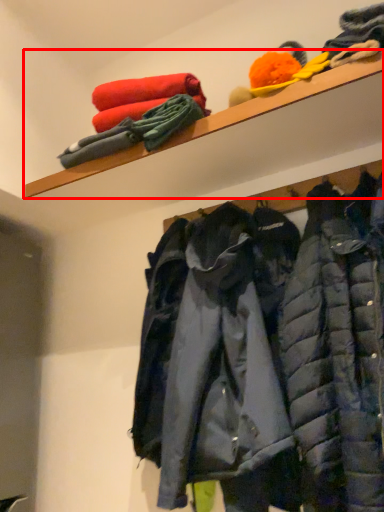
Question: Observing the image, what is the correct spatial positioning of shelf (annotated by the red box) in reference to jacket?

Choices:
 (A) right
 (B) left

Answer: (B)